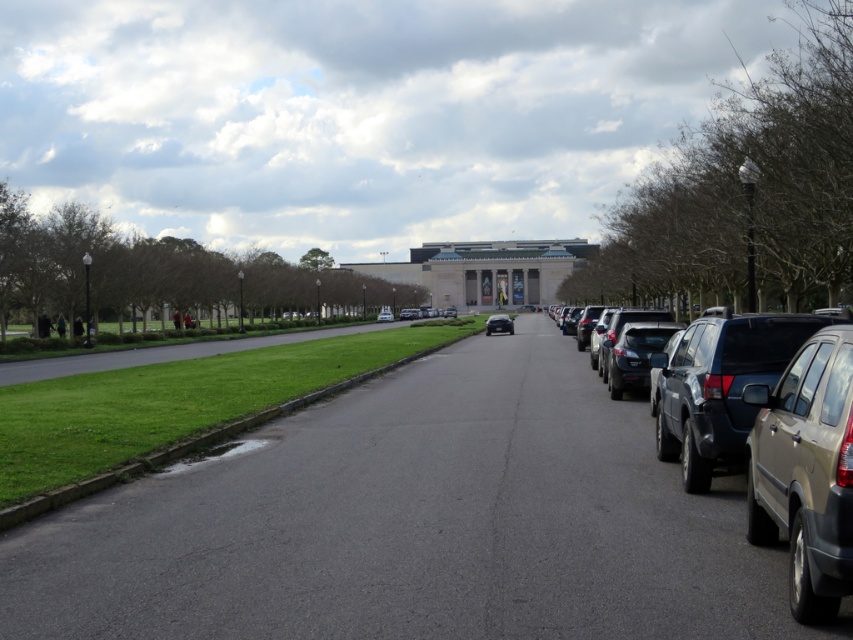
You are standing at the origin point in the image. You see a gold matte suv at right located at point (805,472). If you walk straight ahead, will you reach the gold matte suv at right before the road ends?

The gold matte suv at right is located at point (805,472), which is along the road. Since the road stretches into the distance, walking straight ahead would lead you towards the gold matte suv at right before the road ends.

You are a delivery driver who needs to park your gold matte suv at right in a spot that is exactly at the point marked by coordinates (805,472). The parking spot is marked by a white line. Can you confirm if the gold matte suv at right is already parked within the designated parking spot at those coordinates?

The point (805,472) marks the gold matte suv at right, so yes, the gold matte suv at right is already parked at the designated parking spot at those coordinates.